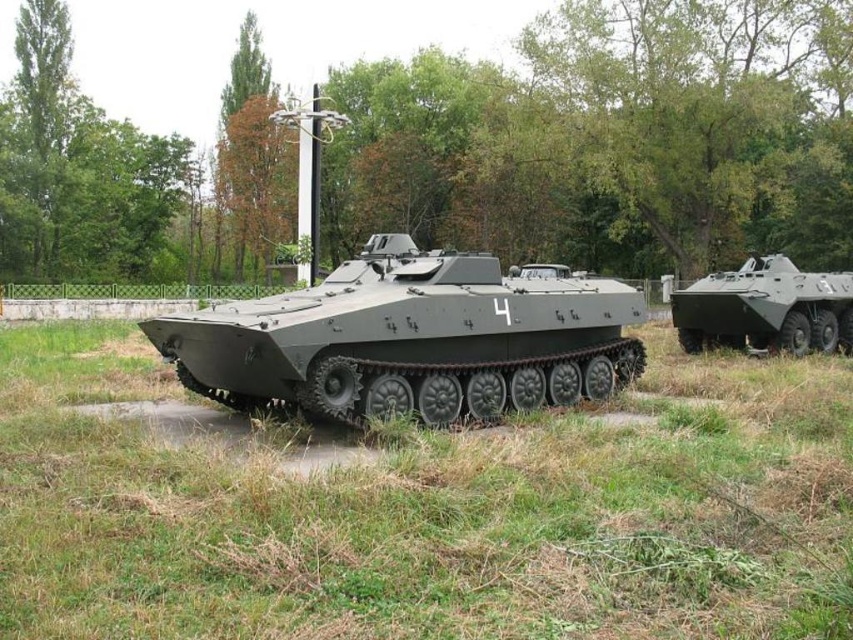
You are a military engineer tasked with moving the matte gray tank at center to a new location. The area is currently covered with green matte grass at center. What should you be cautious about regarding the width of the grass area compared to the tank?

The green matte grass at center might be wider than the matte gray tank at center, so you should verify the width of the grass area to ensure it can accommodate the tank during movement.

You are a park visitor who wants to take a photo of the matte gray tank at center. You are standing on the green matte grass at center. To get the best shot, should you move to your left or right side?

The green matte grass at center is positioned on the left side of matte gray tank at center, so you should move to your right side to get a better view of the matte gray tank at center.

You are standing at the point labeled as point (428,513) in the image. What is the material of the ground beneath your feet?

The point (428,513) indicates green matte grass at center, so the material of the ground beneath your feet is grass.